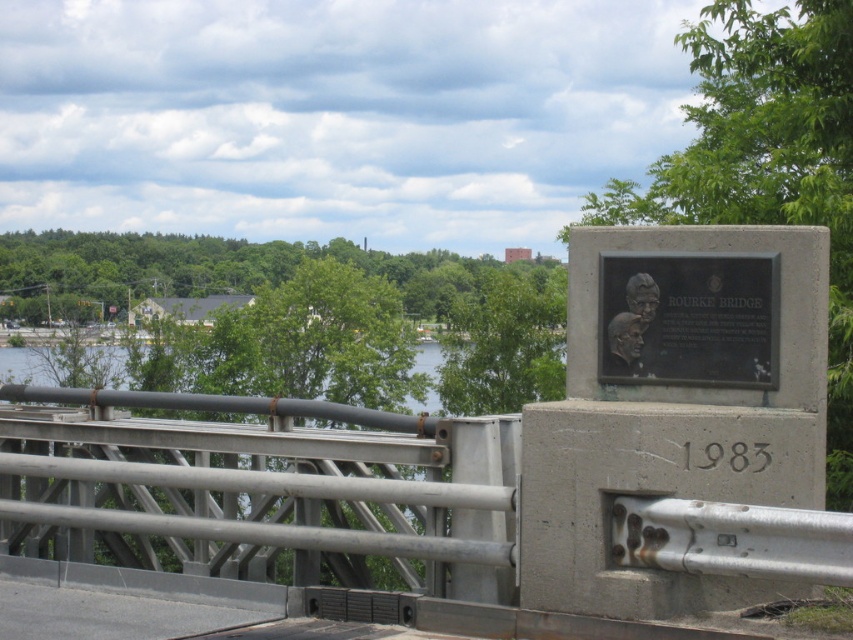
You are standing on Rourke Bridge and want to take a photo of both the point at coordinates point (399, 577) and point (734, 260). Which point is closer to you, the photographer?

Point (399, 577) is further to the viewer than point (734, 260), so the point (734, 260) is closer to you.

You are a tour guide explaining the historical significance of the gray metallic bridge at center and the black polished metal plaque at center. Which object is closer to the visitors standing on the bridge?

The gray metallic bridge at center is closer to the visitors standing on the bridge because it is in front of the black polished metal plaque at center.

You are a tourist standing on the gray metallic bridge at center and want to take a photo of the gray concrete plaque at right. Is the plaque visible from your current position on the bridge?

The gray metallic bridge at center is positioned under the gray concrete plaque at right, so the plaque should be visible from the bridge as it is located above the bridge structure.